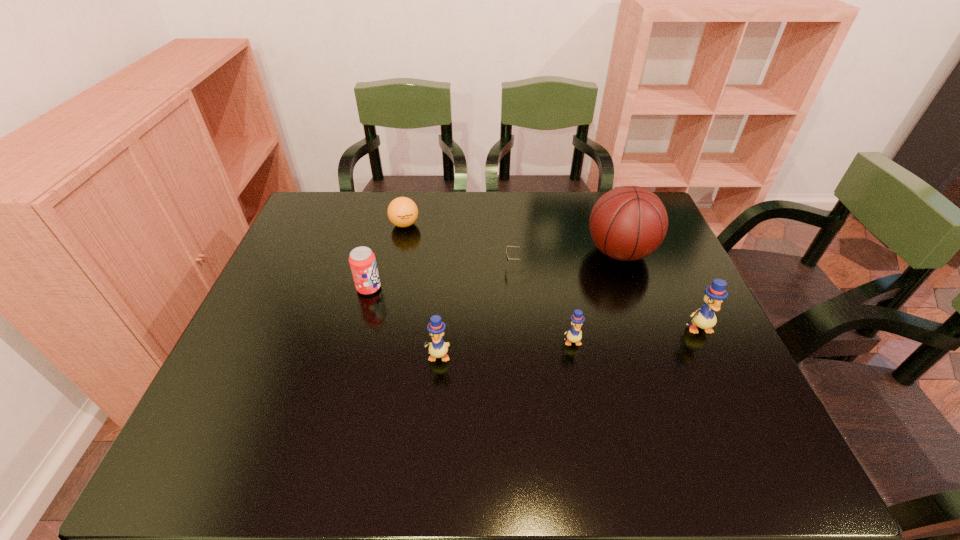
The width and height of the screenshot is (960, 540). I want to click on basketball that is at the far edge, so click(628, 223).

Locate an element on the screen. This screenshot has height=540, width=960. ping-pong ball at the far edge is located at coordinates (402, 211).

Find the location of a particular element. duckling that is at the right edge is located at coordinates coord(704,318).

Identify the location of basketball located in the right edge section of the desktop. Image resolution: width=960 pixels, height=540 pixels. (628, 223).

You are a GUI agent. You are given a task and a screenshot of the screen. Output one action in this format:
    pyautogui.click(x=<x>, y=<y>)
    Task: Click on the object that is at the far right corner
    The height and width of the screenshot is (540, 960).
    Given the screenshot: What is the action you would take?
    pyautogui.click(x=628, y=223)

This screenshot has width=960, height=540. Identify the location of free spot at the far edge of the desktop. (504, 199).

Find the location of a particular element. This screenshot has height=540, width=960. free space at the near edge of the desktop is located at coordinates (467, 402).

You are a GUI agent. You are given a task and a screenshot of the screen. Output one action in this format:
    pyautogui.click(x=<x>, y=<y>)
    Task: Click on the free spot at the left edge of the desktop
    This screenshot has width=960, height=540.
    Given the screenshot: What is the action you would take?
    click(x=259, y=303)

You are a GUI agent. You are given a task and a screenshot of the screen. Output one action in this format:
    pyautogui.click(x=<x>, y=<y>)
    Task: Click on the free space at the right edge of the desktop
    
    Given the screenshot: What is the action you would take?
    pyautogui.click(x=651, y=265)

At what (x,y) coordinates should I click in order to perform the action: click on vacant area at the far left corner of the desktop. Please return your answer as a coordinate pair (x, y). Image resolution: width=960 pixels, height=540 pixels. Looking at the image, I should click on (312, 228).